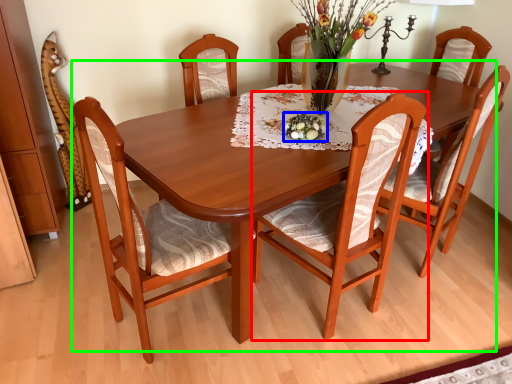
Question: Considering the real-world distances, which object is farthest from chair (highlighted by a red box)? tableware (highlighted by a blue box) or kitchen & dining room table (highlighted by a green box)?

Choices:
 (A) tableware
 (B) kitchen & dining room table

Answer: (A)